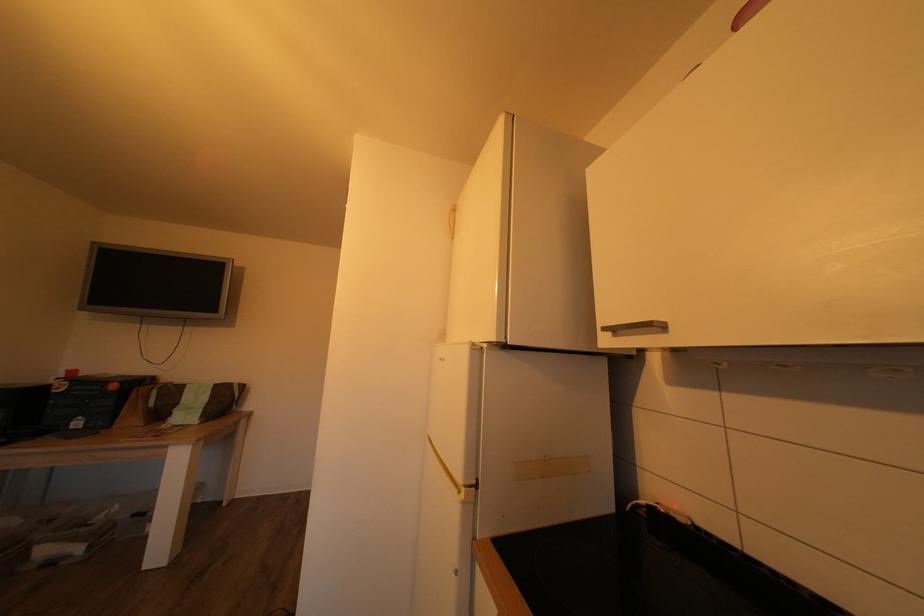
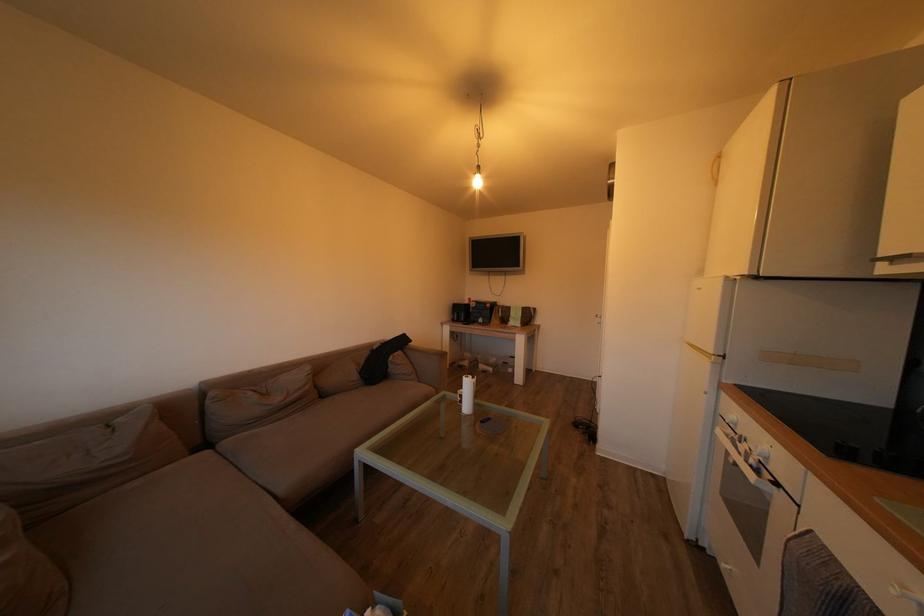
Where in the second image is the point corresponding to (188,394) from the first image?

(517, 314)